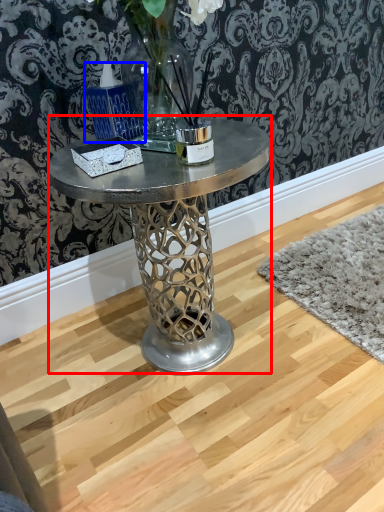
Question: Among these objects, which one is farthest to the camera, coffee table (highlighted by a red box) or candle holder (highlighted by a blue box)?

Choices:
 (A) coffee table
 (B) candle holder

Answer: (A)